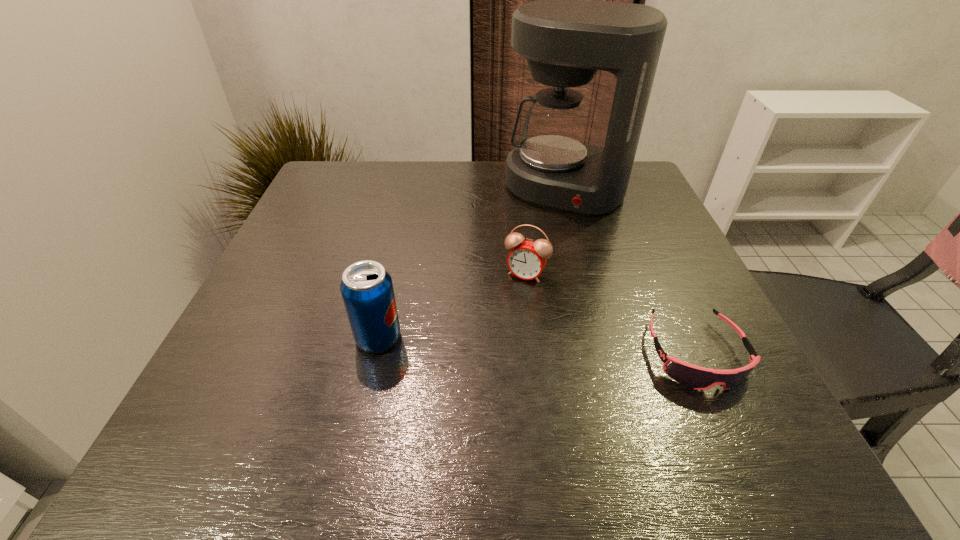
I want to click on vacant space at the far edge, so click(x=457, y=204).

This screenshot has height=540, width=960. I want to click on vacant space at the near edge, so click(489, 382).

At what (x,y) coordinates should I click in order to perform the action: click on free space at the left edge of the desktop. Please return your answer as a coordinate pair (x, y). The image size is (960, 540). Looking at the image, I should click on (279, 254).

At what (x,y) coordinates should I click in order to perform the action: click on blank space at the right edge of the desktop. Please return your answer as a coordinate pair (x, y). This screenshot has width=960, height=540. Looking at the image, I should click on (632, 209).

Find the location of a particular element. free space at the far left corner of the desktop is located at coordinates (372, 188).

Locate an element on the screen. The width and height of the screenshot is (960, 540). vacant space at the near left corner is located at coordinates (209, 404).

I want to click on blank space at the far right corner of the desktop, so click(x=638, y=189).

Image resolution: width=960 pixels, height=540 pixels. Identify the location of unoccupied area between the alarm clock and the goggles. (611, 314).

Locate an element on the screen. free area in between the third nearest object and the leftmost object is located at coordinates (452, 306).

Where is `vacant area that lies between the farthest object and the shortest object`? The height and width of the screenshot is (540, 960). vacant area that lies between the farthest object and the shortest object is located at coordinates (630, 271).